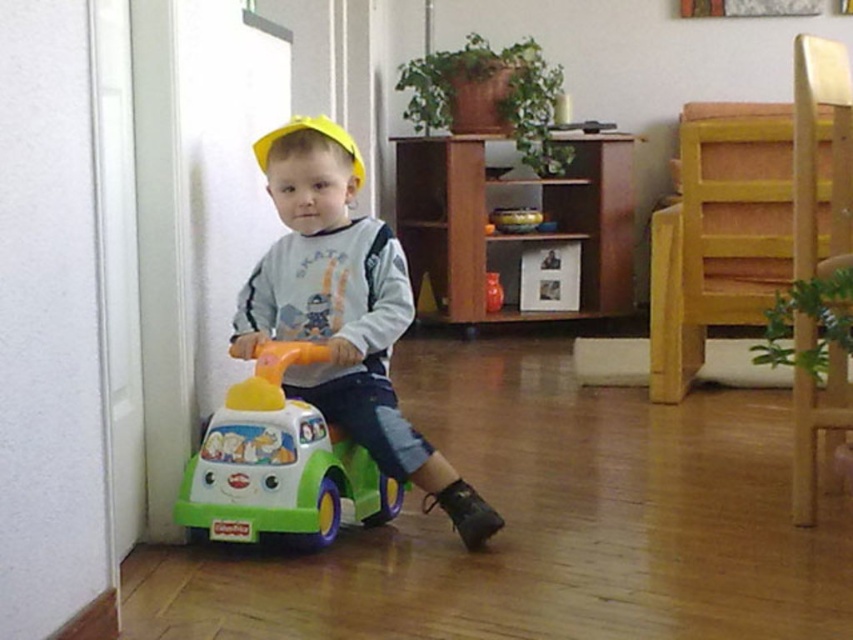
Is point (312, 216) in front of point (308, 528)?

That is False.

In the scene shown: Is matte plastic toy car at center below green plastic car at lower left?

No, matte plastic toy car at center is not below green plastic car at lower left.

The height and width of the screenshot is (640, 853). Find the location of `matte plastic toy car at center`. matte plastic toy car at center is located at coordinates (343, 310).

In order to click on matte plastic toy car at center in this screenshot , I will do `click(343, 310)`.

Does point (323, 520) lie behind point (311, 124)?

No.

Who is taller, green plastic car at lower left or yellow matte hat at center?

green plastic car at lower left is taller.

What do you see at coordinates (279, 465) in the screenshot? This screenshot has width=853, height=640. I see `green plastic car at lower left` at bounding box center [279, 465].

You are a GUI agent. You are given a task and a screenshot of the screen. Output one action in this format:
    pyautogui.click(x=<x>, y=<y>)
    Task: Click on the green plastic car at lower left
    The image size is (853, 640).
    Given the screenshot: What is the action you would take?
    pyautogui.click(x=279, y=465)

Is matte plastic toy car at center shorter than yellow matte hat at center?

Incorrect, matte plastic toy car at center's height does not fall short of yellow matte hat at center's.

Who is positioned more to the left, matte plastic toy car at center or yellow matte hat at center?

From the viewer's perspective, yellow matte hat at center appears more on the left side.

Measure the distance between point (341, 268) and camera.

Point (341, 268) is 1.71 meters from camera.

Identify the location of matte plastic toy car at center. This screenshot has width=853, height=640. (343, 310).